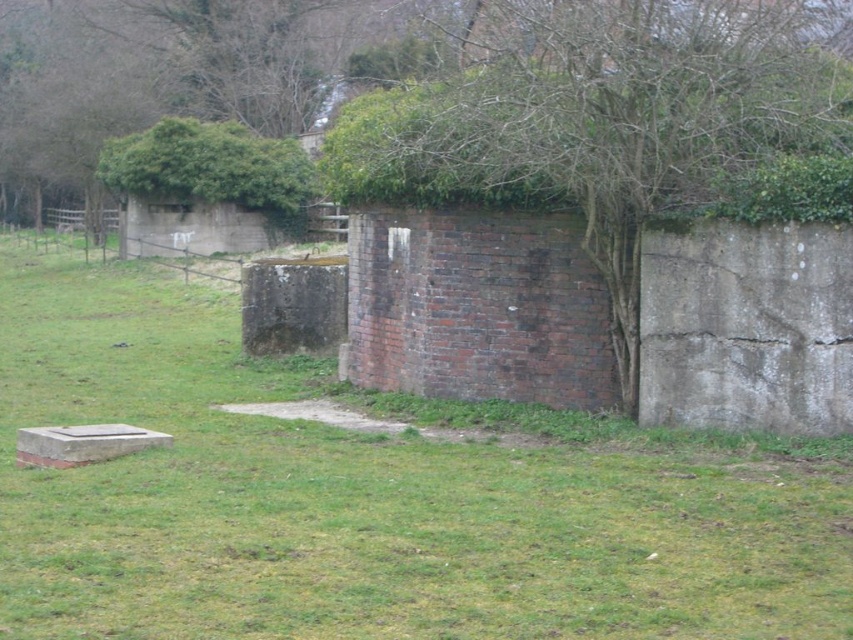
Which is more to the left, green grassy at lower left or green leafy tree at upper right?

Positioned to the left is green grassy at lower left.

Is green grassy at lower left shorter than green leafy tree at upper right?

Yes, green grassy at lower left is shorter than green leafy tree at upper right.

I want to click on green grassy at lower left, so click(x=373, y=497).

Between green leafy tree at upper right and green leafy hedge at upper left, which one appears on the right side from the viewer's perspective?

Positioned to the right is green leafy tree at upper right.

Who is more forward, (x=492, y=157) or (x=165, y=193)?

Point (x=492, y=157)

Is point (503, 33) positioned in front of point (177, 131)?

Yes, point (503, 33) is in front of point (177, 131).

The image size is (853, 640). I want to click on green leafy tree at upper right, so click(x=618, y=116).

Looking at this image, is green grassy at lower left to the right of green leafy hedge at upper left from the viewer's perspective?

Yes, green grassy at lower left is to the right of green leafy hedge at upper left.

Does green grassy at lower left appear on the left side of green leafy hedge at upper left?

No, green grassy at lower left is not to the left of green leafy hedge at upper left.

Which is behind, point (202, 596) or point (241, 124)?

Positioned behind is point (241, 124).

I want to click on green grassy at lower left, so click(373, 497).